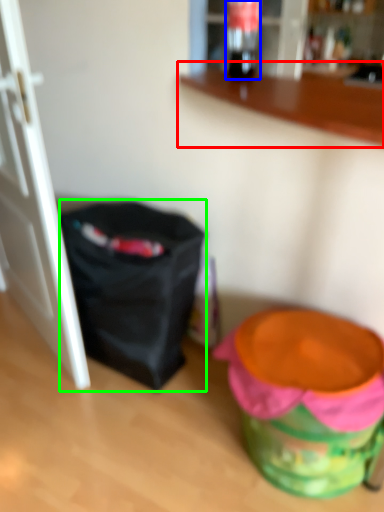
Question: Considering the real-world distances, which object is closest to counter (highlighted by a red box)? beverage (highlighted by a blue box) or bag (highlighted by a green box).

Choices:
 (A) beverage
 (B) bag

Answer: (B)